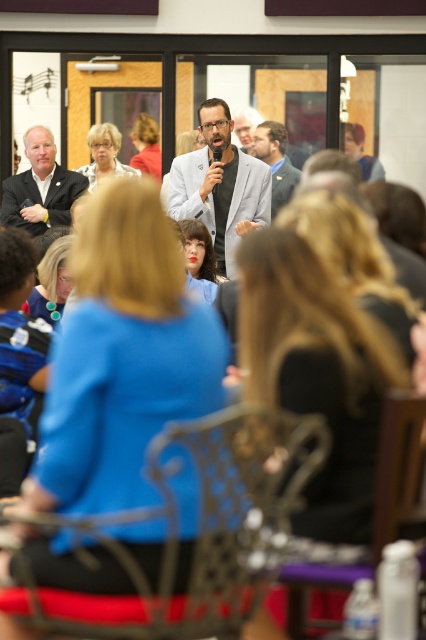
Between point (397, 397) and point (92, 173), which one is positioned behind?

The point (92, 173) is more distant.

Is point (389, 518) positioned behind point (106, 163)?

That is False.

What are the coordinates of `metallic silver chair at lower center` in the screenshot? It's located at (374, 502).

Who is more forward, (36,228) or (290,177)?

Positioned in front is point (36,228).

Between point (37, 164) and point (279, 202), which one is positioned behind?

The point (279, 202) is more distant.

Is point (58, 180) positioned behind point (273, 180)?

No.

Locate an element on the screen. matte black suit at left is located at coordinates (40, 186).

Is matte black suit at left thinner than matte black jacket at upper right?

In fact, matte black suit at left might be wider than matte black jacket at upper right.

Consider the image. Is matte black suit at left below matte black jacket at upper right?

Yes.

Does point (60, 172) come farther from viewer compared to point (376, 173)?

Yes, it is.

What are the coordinates of `matte black suit at left` in the screenshot? It's located at (40, 186).